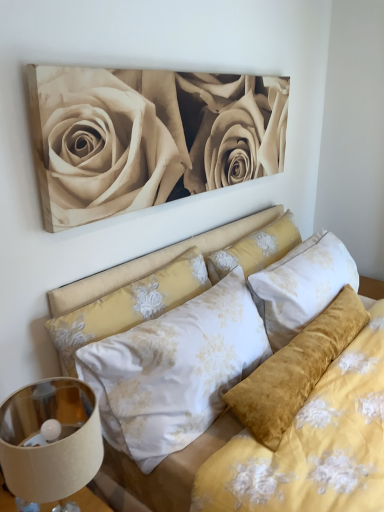
Question: Would you say white floral fabric pillow at center, the second pillow when ordered from right to left, contains metallic beige lampshade at lower left?

Choices:
 (A) no
 (B) yes

Answer: (A)

Question: Can you confirm if white floral fabric pillow at center, placed as the first pillow when sorted from left to right, is positioned to the left of metallic beige lampshade at lower left?

Choices:
 (A) no
 (B) yes

Answer: (A)

Question: Is white floral fabric pillow at center, placed as the first pillow when sorted from left to right, with metallic beige lampshade at lower left?

Choices:
 (A) no
 (B) yes

Answer: (A)

Question: Is white floral fabric pillow at center, the second pillow when ordered from right to left, to the right of metallic beige lampshade at lower left from the viewer's perspective?

Choices:
 (A) no
 (B) yes

Answer: (B)

Question: Is white floral fabric pillow at center, placed as the first pillow when sorted from left to right, not close to metallic beige lampshade at lower left?

Choices:
 (A) no
 (B) yes

Answer: (A)

Question: Does white floral fabric pillow at center, placed as the first pillow when sorted from left to right, turn towards metallic beige lampshade at lower left?

Choices:
 (A) yes
 (B) no

Answer: (B)

Question: Is velvet yellow bed at center positioned with its back to beige matte/soft canvas at upper center?

Choices:
 (A) no
 (B) yes

Answer: (A)

Question: Is velvet yellow bed at center wider than beige matte/soft canvas at upper center?

Choices:
 (A) no
 (B) yes

Answer: (B)

Question: Is the depth of velvet yellow bed at center greater than that of beige matte/soft canvas at upper center?

Choices:
 (A) no
 (B) yes

Answer: (A)

Question: Does velvet yellow bed at center have a larger size compared to beige matte/soft canvas at upper center?

Choices:
 (A) no
 (B) yes

Answer: (B)

Question: Can you confirm if velvet yellow bed at center is shorter than beige matte/soft canvas at upper center?

Choices:
 (A) no
 (B) yes

Answer: (A)

Question: Considering the relative positions of velvet yellow bed at center and beige matte/soft canvas at upper center in the image provided, is velvet yellow bed at center in front of beige matte/soft canvas at upper center?

Choices:
 (A) no
 (B) yes

Answer: (B)

Question: From the image's perspective, is beige matte/soft canvas at upper center beneath velvet yellow pillow at center, which is the 1th pillow from right to left?

Choices:
 (A) yes
 (B) no

Answer: (B)